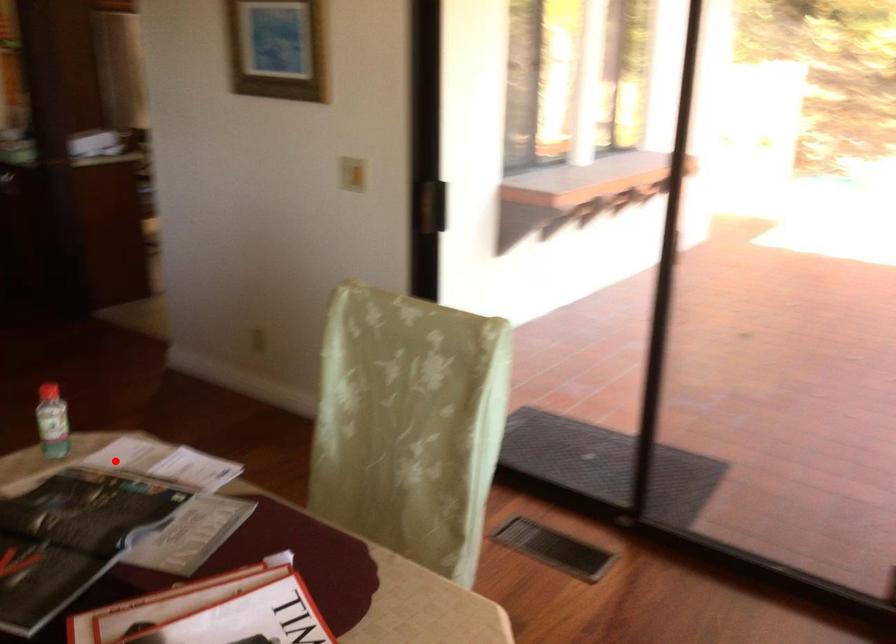
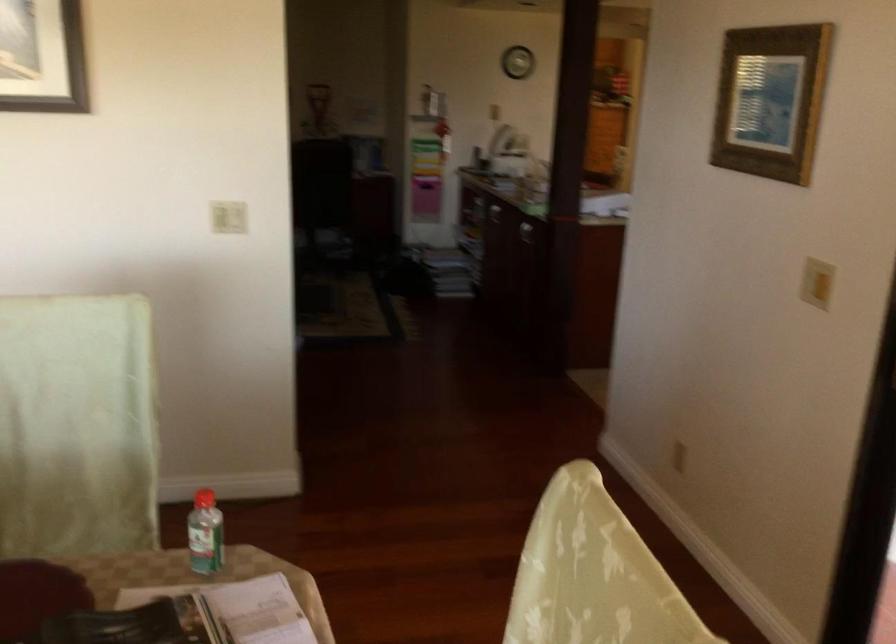
Question: A red point is marked in image1. In image2, is the corresponding 3D point closer to the camera or farther? Reply with the corresponding letter.

Choices:
 (A) The corresponding 3D point is closer.
 (B) The corresponding 3D point is farther.

Answer: (A)